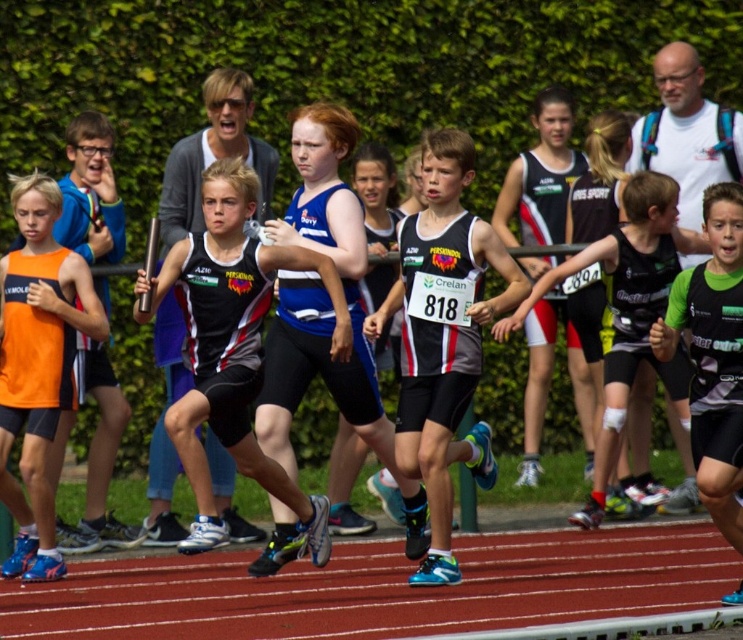
Between point (646, 317) and point (710, 509), which one is positioned in front?

Point (710, 509) is more forward.

Does black matte tank top at center have a greater height compared to green matte tank top at center?

Correct, black matte tank top at center is much taller as green matte tank top at center.

Which is behind, point (642, 214) or point (739, 586)?

Point (642, 214)

Locate an element on the screen. This screenshot has width=743, height=640. black matte tank top at center is located at coordinates (629, 310).

Measure the distance between matte gray vest at center and green matte tank top at center.

matte gray vest at center is 1.92 meters away from green matte tank top at center.

Can you confirm if matte gray vest at center is shorter than green matte tank top at center?

No, matte gray vest at center is not shorter than green matte tank top at center.

Is point (441, 544) positioned in front of point (736, 424)?

No, it is not.

Image resolution: width=743 pixels, height=640 pixels. Identify the location of matte gray vest at center. (444, 337).

Which of these two, matte gray vest at center or black matte tank top at center, stands shorter?

black matte tank top at center

Consider the image. Does matte gray vest at center appear over black matte tank top at center?

Indeed, matte gray vest at center is positioned over black matte tank top at center.

Which is behind, point (421, 323) or point (661, 376)?

The point (661, 376) is more distant.

Identify the location of matte gray vest at center. The width and height of the screenshot is (743, 640). (444, 337).